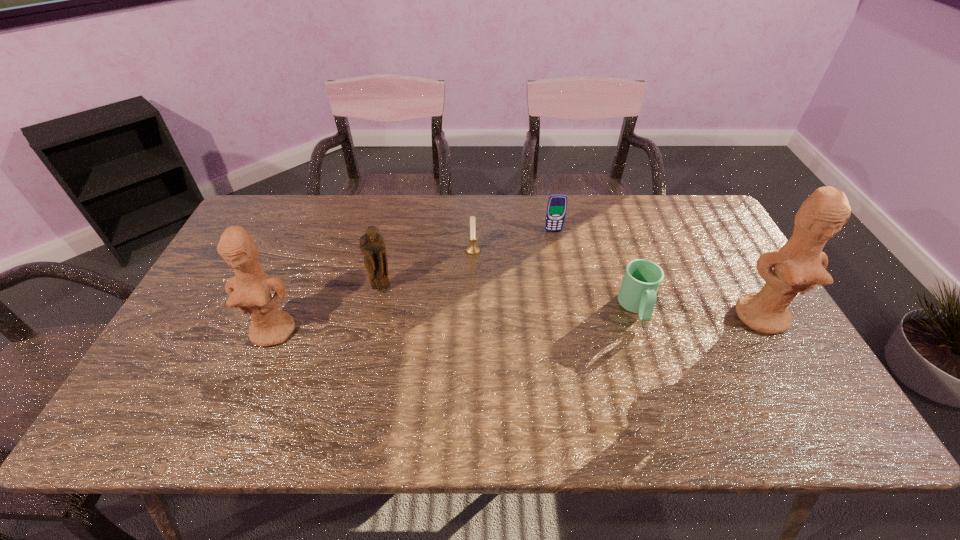
In order to click on unoccupied area between the tallest figurine and the fifth object from left to right in this screenshot , I will do `click(699, 313)`.

In order to click on vacant space that is in between the candle holder and the fifth object from left to right in this screenshot , I will do `click(555, 279)`.

Where is `vacant space that's between the fourth object from right to left and the second object from right to left`? Image resolution: width=960 pixels, height=540 pixels. vacant space that's between the fourth object from right to left and the second object from right to left is located at coordinates (555, 279).

At what (x,y) coordinates should I click in order to perform the action: click on free space between the leftmost figurine and the rightmost figurine. Please return your answer as a coordinate pair (x, y). This screenshot has width=960, height=540. Looking at the image, I should click on (518, 324).

I want to click on vacant area between the candle holder and the third tallest object, so click(428, 270).

At what (x,y) coordinates should I click in order to perform the action: click on object that is the nearest to the leftmost figurine. Please return your answer as a coordinate pair (x, y). Looking at the image, I should click on (372, 245).

Identify the location of object identified as the second closest to the third object from left to right. (372, 245).

Select which figurine appears as the third closest to the second object from right to left. Please provide its 2D coordinates. Your answer should be formatted as a tuple, i.e. [(x, y)], where the tuple contains the x and y coordinates of a point satisfying the conditions above.

[(250, 290)]

Identify which figurine is the second nearest to the mug. Please provide its 2D coordinates. Your answer should be formatted as a tuple, i.e. [(x, y)], where the tuple contains the x and y coordinates of a point satisfying the conditions above.

[(372, 245)]